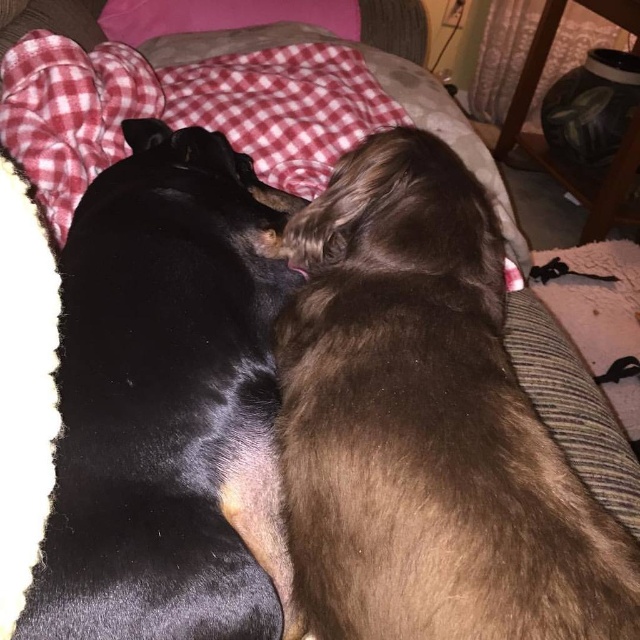
Can you confirm if brown fluffy dog at upper center is shorter than black soft fur dog at center?

Yes.

Does brown fluffy dog at upper center appear over black soft fur dog at center?

No.

Who is more distant from viewer, (424, 182) or (88, 333)?

The point (424, 182) is behind.

In order to click on brown fluffy dog at upper center in this screenshot , I will do `click(426, 426)`.

This screenshot has height=640, width=640. Find the location of `brown fluffy dog at upper center`. brown fluffy dog at upper center is located at coordinates (426, 426).

Is brown fluffy dog at upper center in front of red plaid blanket at upper left?

Yes, it is.

This screenshot has width=640, height=640. What are the coordinates of `brown fluffy dog at upper center` in the screenshot? It's located at (426, 426).

Which is in front, point (96, 326) or point (13, 61)?

Point (96, 326)

Is the position of black soft fur dog at center more distant than that of red plaid blanket at upper left?

No.

Does point (76, 545) lie in front of point (333, 156)?

Yes, it is.

I want to click on black soft fur dog at center, so click(x=166, y=403).